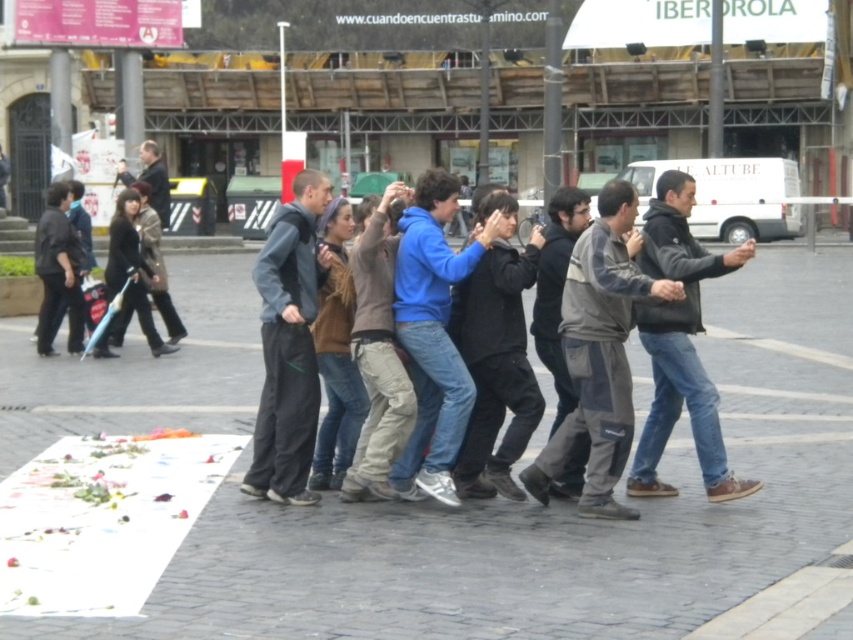
Which is behind, point (434, 476) or point (126, 186)?

Positioned behind is point (126, 186).

Which is more to the right, blue fleece jacket at center or dark brown leather jacket at left?

Positioned to the right is blue fleece jacket at center.

Between point (486, 221) and point (144, 193), which one is positioned in front?

Point (486, 221) is more forward.

Locate an element on the screen. The width and height of the screenshot is (853, 640). blue fleece jacket at center is located at coordinates (433, 333).

Is dark gray hoodie at center taller than dark brown leather jacket at left?

No, dark gray hoodie at center is not taller than dark brown leather jacket at left.

Does dark gray hoodie at center have a smaller size compared to dark brown leather jacket at left?

Yes, dark gray hoodie at center is smaller than dark brown leather jacket at left.

Who is more forward, (637, 467) or (140, 209)?

Point (637, 467) is more forward.

You are a GUI agent. You are given a task and a screenshot of the screen. Output one action in this format:
    pyautogui.click(x=<x>, y=<y>)
    Task: Click on the dark gray hoodie at center
    The height and width of the screenshot is (640, 853).
    Given the screenshot: What is the action you would take?
    pyautogui.click(x=680, y=344)

Is blue fleece jacket at center wider than black matte jacket at center?

Yes.

Looking at this image, is blue fleece jacket at center bigger than black matte jacket at center?

No.

Is point (450, 362) positioned after point (486, 486)?

No, it is in front of (486, 486).

What are the coordinates of `blue fleece jacket at center` in the screenshot? It's located at (433, 333).